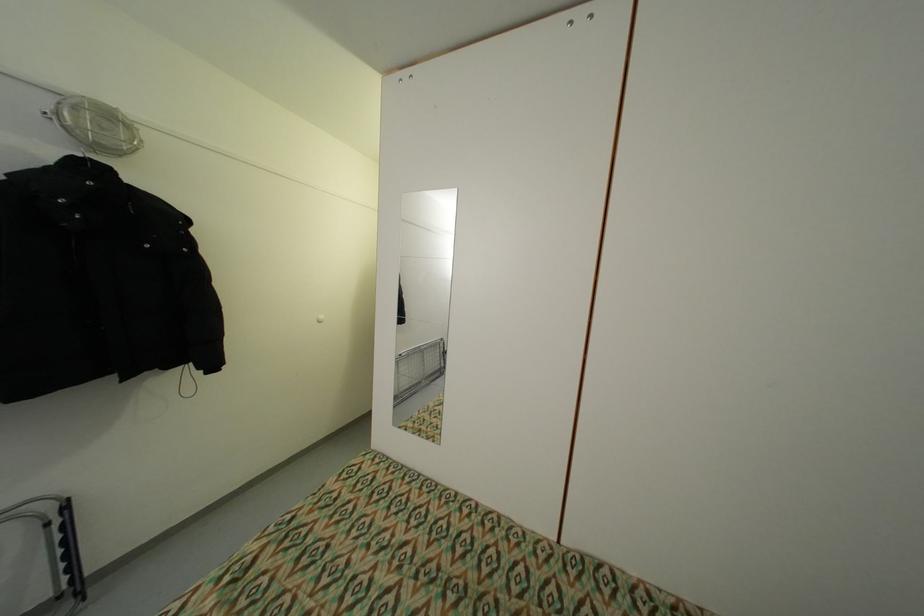
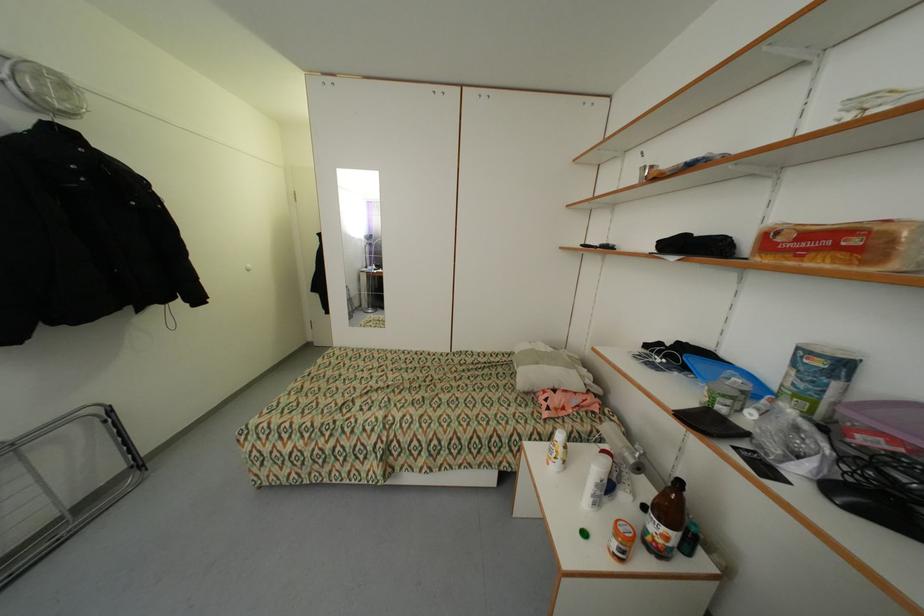
Find the pixel in the second image that matches point 54,525 in the first image.

(112, 422)